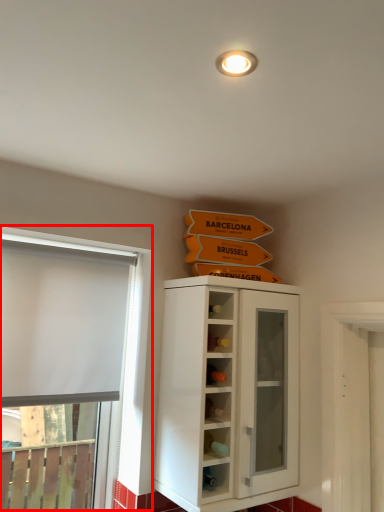
Question: From the image's perspective, what is the correct spatial positioning of window (annotated by the red box) in reference to cupboard?

Choices:
 (A) below
 (B) above

Answer: (B)